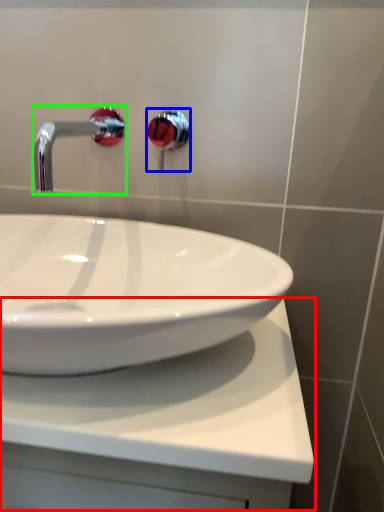
Question: Based on their relative distances, which object is nearer to counter top (highlighted by a red box)? Choose from plumbing fixture (highlighted by a blue box) and tap (highlighted by a green box).

Choices:
 (A) plumbing fixture
 (B) tap

Answer: (B)